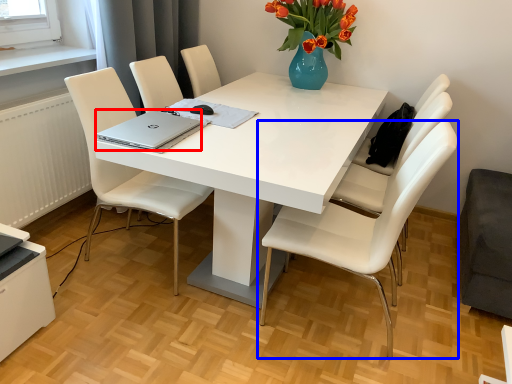
Question: Which object appears closest to the camera in this image, laptop (highlighted by a red box) or chair (highlighted by a blue box)?

Choices:
 (A) laptop
 (B) chair

Answer: (B)